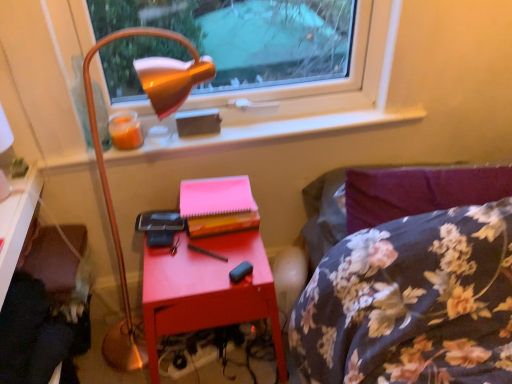
Find the location of a particular element. The image size is (512, 384). free space above matte plastic window sill at upper center (from a real-world perspective) is located at coordinates (207, 130).